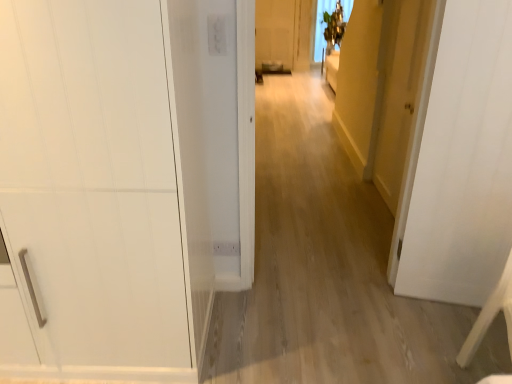
Where is `vacant space underneath white matte door at center, the second door viewed from the right (from a real-world perspective)`? Image resolution: width=512 pixels, height=384 pixels. vacant space underneath white matte door at center, the second door viewed from the right (from a real-world perspective) is located at coordinates (428, 296).